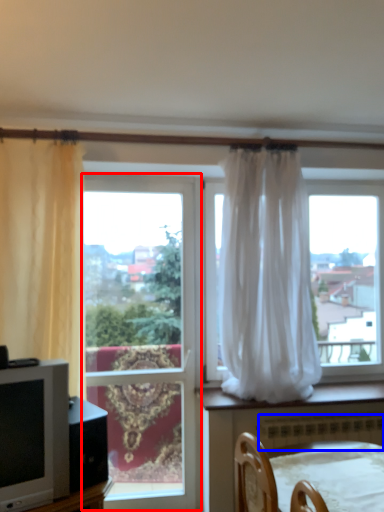
Question: Which object appears farthest to the camera in this image, window (highlighted by a red box) or radiator (highlighted by a blue box)?

Choices:
 (A) window
 (B) radiator

Answer: (A)